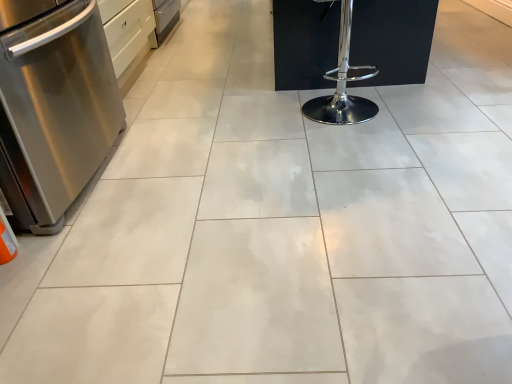
Locate an element on the screen. The height and width of the screenshot is (384, 512). free space in front of chrome/metallic bar stool at center-right is located at coordinates (357, 141).